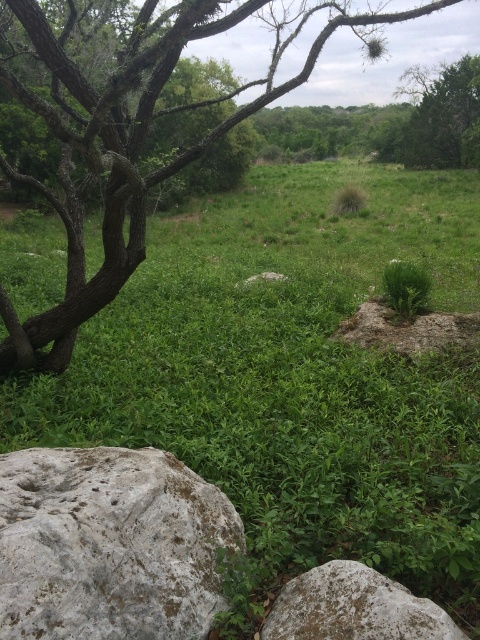
Question: Is gray rough rock at lower left positioned before gray rough rock at lower right?

Choices:
 (A) no
 (B) yes

Answer: (B)

Question: Does gray rough rock at lower left have a lesser width compared to gray rough rock at lower right?

Choices:
 (A) yes
 (B) no

Answer: (B)

Question: Is gray rough rock at lower left bigger than green leafy tree at left?

Choices:
 (A) yes
 (B) no

Answer: (B)

Question: Considering the real-world distances, which object is closest to the gray rough rock at lower left?

Choices:
 (A) gray rough rock at lower right
 (B) green leafy tree at left

Answer: (A)

Question: Estimate the real-world distances between objects in this image. Which object is farther from the gray rough rock at lower left?

Choices:
 (A) gray rough rock at lower right
 (B) green leafy tree at left

Answer: (B)

Question: Which point is closer to the camera?

Choices:
 (A) gray rough rock at lower right
 (B) gray rough rock at lower left

Answer: (B)